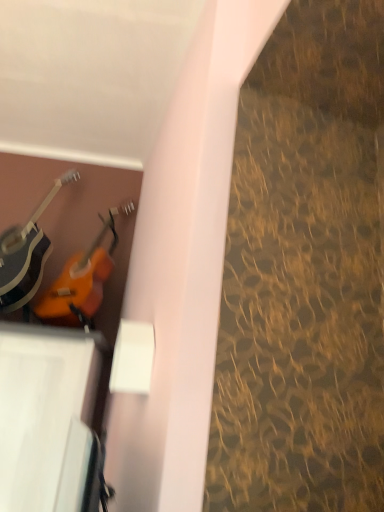
Question: From a real-world perspective, is orange glossy guitar at upper left, which ranks as the 2th guitar in left-to-right order, located beneath matte black guitar at left, the 2th guitar when ordered from right to left?

Choices:
 (A) no
 (B) yes

Answer: (B)

Question: From the image's perspective, is orange glossy guitar at upper left, placed as the first guitar when sorted from right to left, over matte black guitar at left, the first guitar in the left-to-right sequence?

Choices:
 (A) no
 (B) yes

Answer: (A)

Question: Is orange glossy guitar at upper left, placed as the first guitar when sorted from right to left, to the left of matte black guitar at left, the 2th guitar when ordered from right to left, from the viewer's perspective?

Choices:
 (A) yes
 (B) no

Answer: (B)

Question: Does orange glossy guitar at upper left, which ranks as the 2th guitar in left-to-right order, have a smaller size compared to matte black guitar at left, the first guitar in the left-to-right sequence?

Choices:
 (A) yes
 (B) no

Answer: (A)

Question: Can you confirm if orange glossy guitar at upper left, placed as the first guitar when sorted from right to left, is taller than matte black guitar at left, the first guitar in the left-to-right sequence?

Choices:
 (A) yes
 (B) no

Answer: (B)

Question: Is the surface of orange glossy guitar at upper left, which ranks as the 2th guitar in left-to-right order, in direct contact with matte black guitar at left, the first guitar in the left-to-right sequence?

Choices:
 (A) yes
 (B) no

Answer: (B)

Question: Can orange glossy guitar at upper left, placed as the first guitar when sorted from right to left, be found inside matte black guitar at left, the first guitar in the left-to-right sequence?

Choices:
 (A) yes
 (B) no

Answer: (B)

Question: Can you confirm if matte black guitar at left, the 2th guitar when ordered from right to left, is taller than orange glossy guitar at upper left, placed as the first guitar when sorted from right to left?

Choices:
 (A) yes
 (B) no

Answer: (A)

Question: Does matte black guitar at left, the first guitar in the left-to-right sequence, have a larger size compared to orange glossy guitar at upper left, which ranks as the 2th guitar in left-to-right order?

Choices:
 (A) no
 (B) yes

Answer: (B)

Question: Would you say matte black guitar at left, the 2th guitar when ordered from right to left, is a long distance from orange glossy guitar at upper left, which ranks as the 2th guitar in left-to-right order?

Choices:
 (A) yes
 (B) no

Answer: (B)

Question: Is matte black guitar at left, the 2th guitar when ordered from right to left, at the right side of orange glossy guitar at upper left, placed as the first guitar when sorted from right to left?

Choices:
 (A) yes
 (B) no

Answer: (B)

Question: Does matte black guitar at left, the first guitar in the left-to-right sequence, have a lesser width compared to orange glossy guitar at upper left, placed as the first guitar when sorted from right to left?

Choices:
 (A) yes
 (B) no

Answer: (B)

Question: From a real-world perspective, relative to matte black guitar at left, the 2th guitar when ordered from right to left, is orange glossy guitar at upper left, placed as the first guitar when sorted from right to left, vertically above or below?

Choices:
 (A) above
 (B) below

Answer: (B)